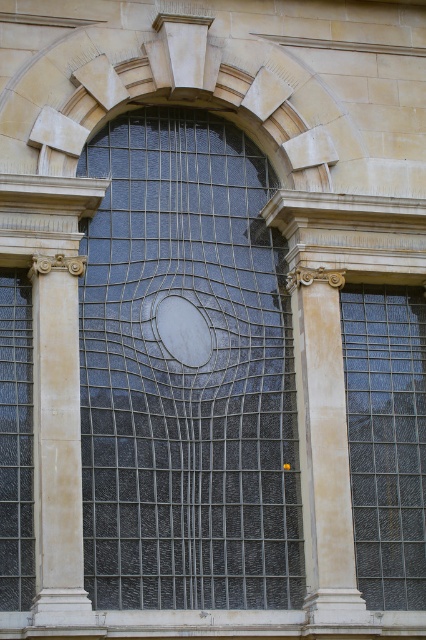
Question: Which point is closer to the camera?

Choices:
 (A) (45, 376)
 (B) (299, 307)
 (C) (422, 451)
 (D) (16, 580)

Answer: (D)

Question: Which object is closer to the camera taking this photo?

Choices:
 (A) white stone column at left
 (B) smooth stone pillar at right
 (C) dark gray textured glass at center

Answer: (A)

Question: Can you confirm if dark gray textured glass at center is smaller than white stone column at left?

Choices:
 (A) yes
 (B) no

Answer: (B)

Question: Does smooth stone pillar at right have a greater width compared to white stone column at left?

Choices:
 (A) no
 (B) yes

Answer: (A)

Question: Does clear textured glass at right have a smaller size compared to clear glass window at left?

Choices:
 (A) no
 (B) yes

Answer: (A)

Question: Which of these objects is positioned closest to the smooth stone pillar at right?

Choices:
 (A) clear textured glass at right
 (B) white stone column at left
 (C) clear glass window at left
 (D) dark gray textured glass at center

Answer: (A)